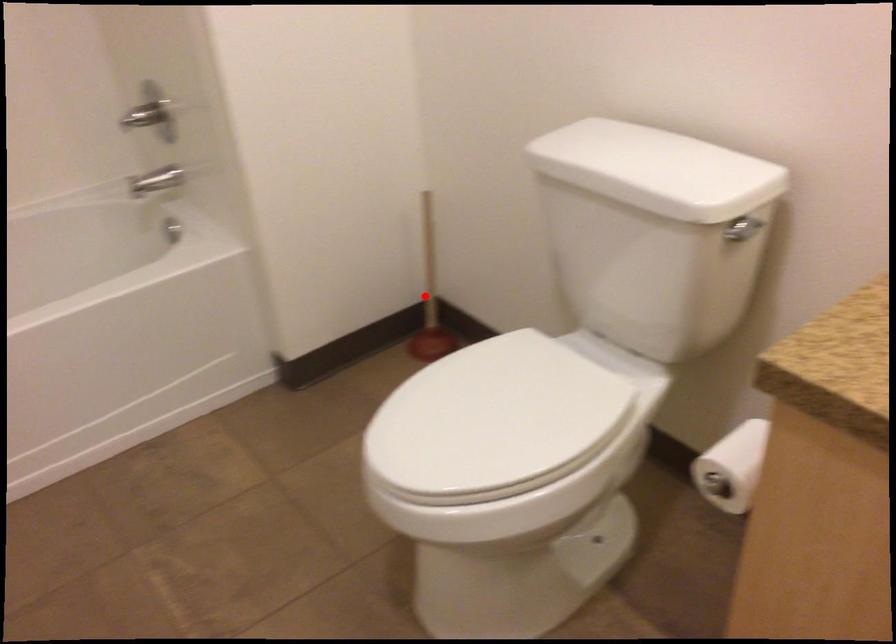
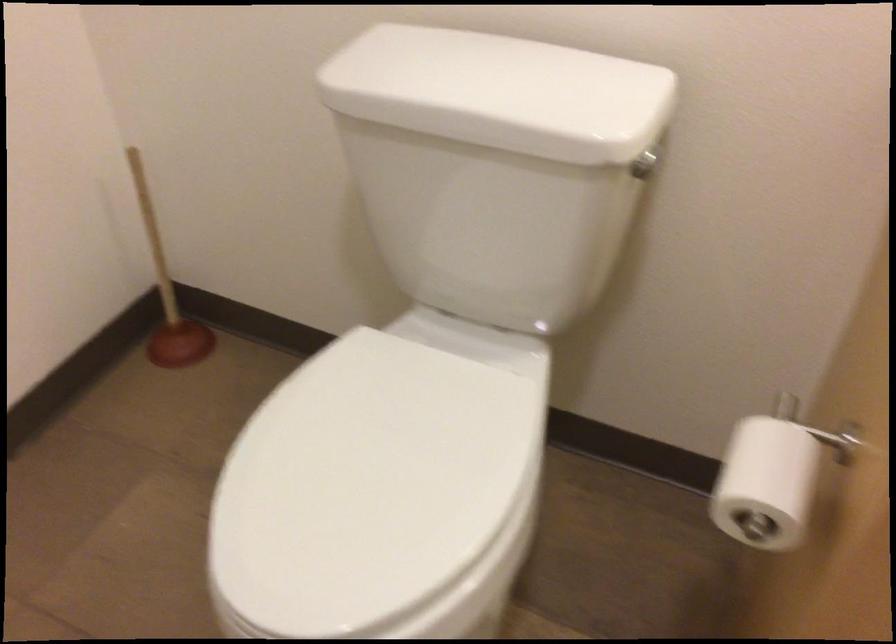
The point at the highlighted location is marked in the first image. Where is the corresponding point in the second image?

(167, 292)